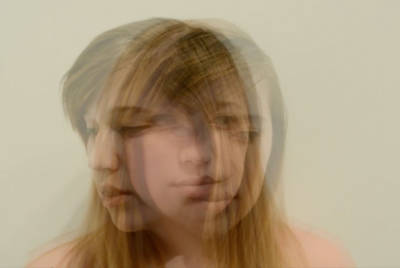
You are a GUI agent. You are given a task and a screenshot of the screen. Output one action in this format:
    pyautogui.click(x=<x>, y=<y>)
    Task: Click on the beige wall
    
    Given the screenshot: What is the action you would take?
    pyautogui.click(x=303, y=81)